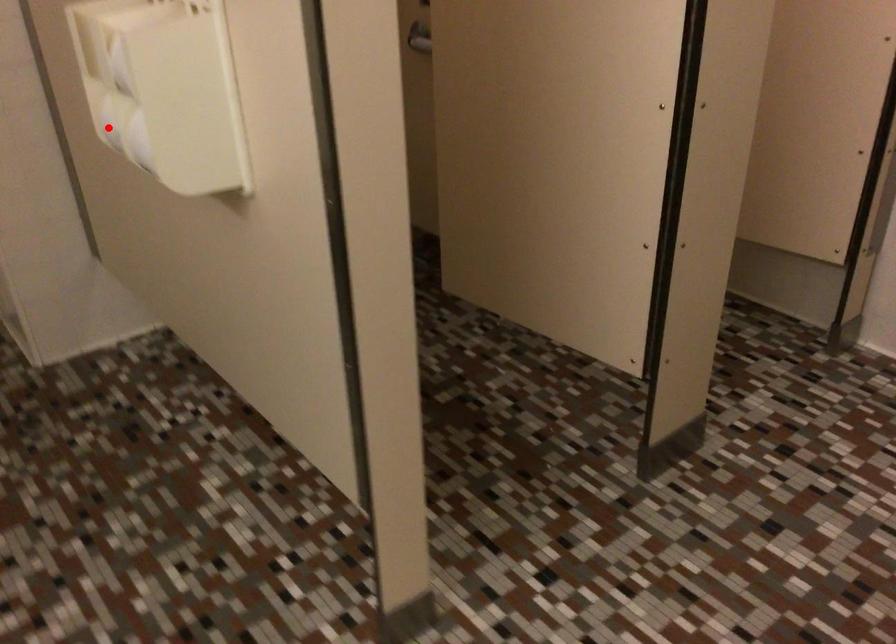
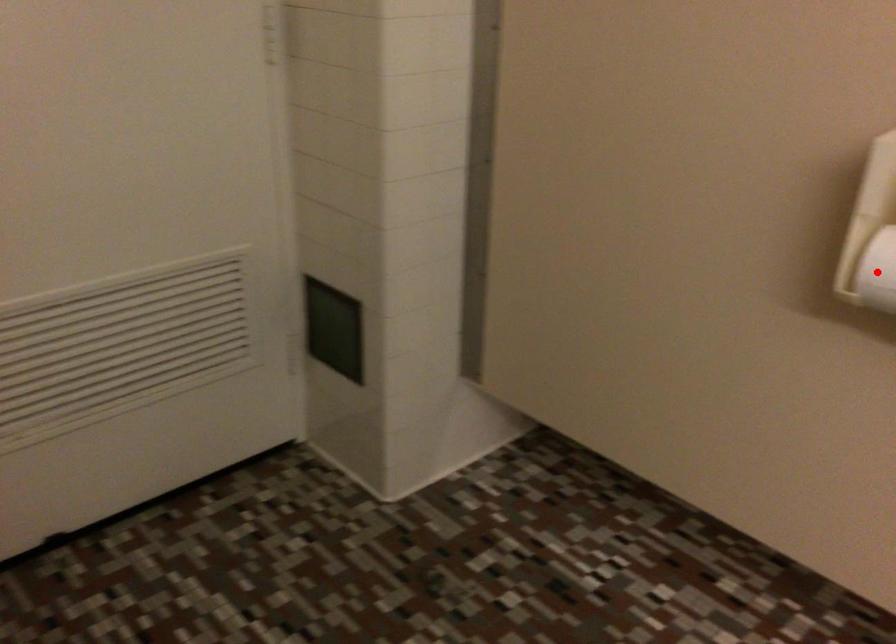
I am providing you with two images of the same scene from different viewpoints. A red point is marked on the first image and another point is marked on the second image. Is the red point in image1 aligned with the point shown in image2?

Yes